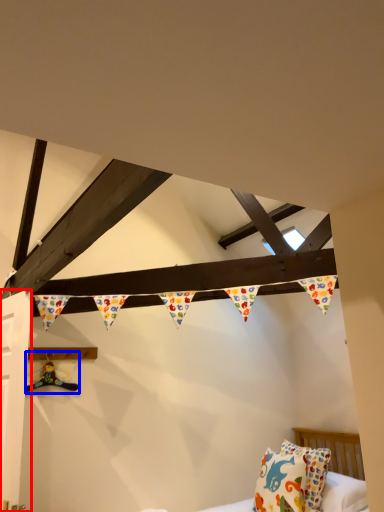
Question: Which of the following is the farthest to the observer, door (highlighted by a red box) or toy (highlighted by a blue box)?

Choices:
 (A) door
 (B) toy

Answer: (B)